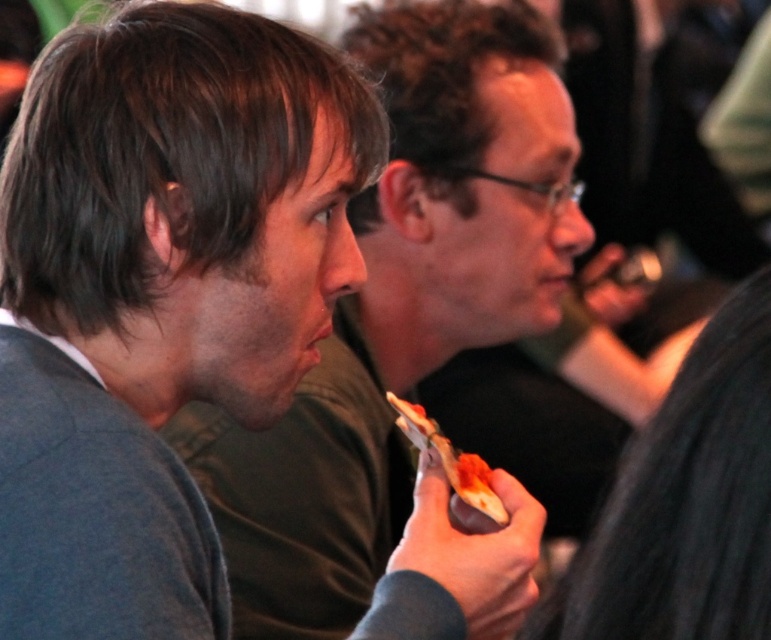
You are a photographer at a social event and notice the dark gray sweater at left and the tomato sauce pizza slice at center. Which object is positioned higher in the image?

The dark gray sweater at left is above the tomato sauce pizza slice at center, so it is positioned higher in the image.

You are standing at the point with coordinates point (665, 500) and want to walk towards the point with coordinates point (490, 516). Since you can only move forward, will you pass in front of or behind the other point?

Since point (665, 500) is in front of point (490, 516), you will pass in front of the other point when moving forward.